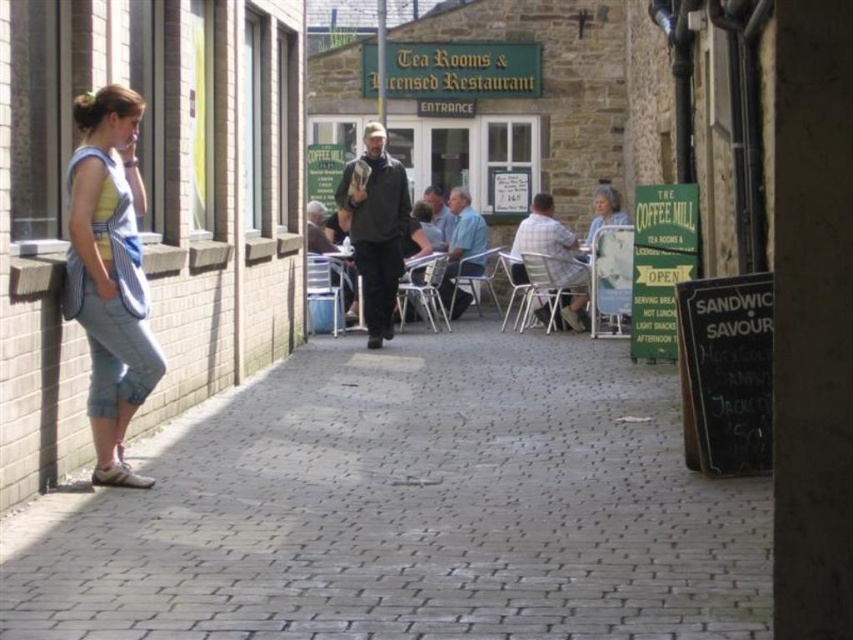
Question: Is gray brick pavement at center bigger than metallic silver table at center?

Choices:
 (A) yes
 (B) no

Answer: (B)

Question: Can you confirm if denim shorts at left is positioned above dark gray jacket at center?

Choices:
 (A) yes
 (B) no

Answer: (B)

Question: Which point appears farthest from the camera in this image?

Choices:
 (A) (112, 348)
 (B) (397, 268)
 (C) (189, 596)

Answer: (B)

Question: Among these points, which one is nearest to the camera?

Choices:
 (A) (138, 348)
 (B) (759, 500)

Answer: (B)

Question: Does gray brick pavement at center lie behind metallic silver table at center?

Choices:
 (A) no
 (B) yes

Answer: (A)

Question: Which point is closer to the camera taking this photo?

Choices:
 (A) (355, 189)
 (B) (641, 500)

Answer: (B)